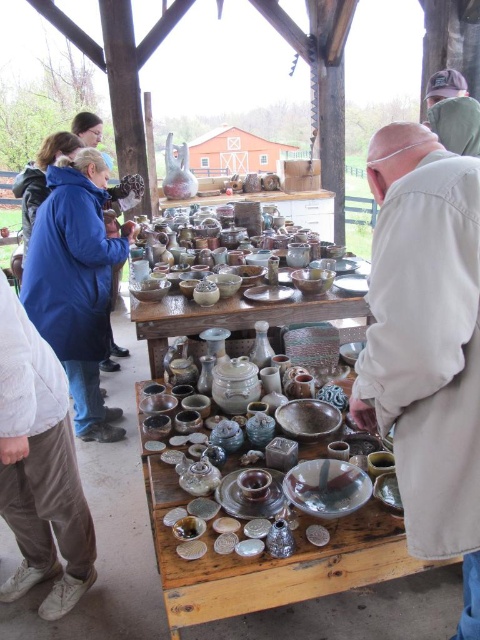
Question: In this image, where is glossy ceramic bowls at center located relative to green fabric cap at upper right?

Choices:
 (A) below
 (B) above

Answer: (A)

Question: In this image, where is glossy ceramic bowls at center located relative to green fabric cap at upper right?

Choices:
 (A) below
 (B) above

Answer: (A)

Question: Based on their relative distances, which object is farther from the glossy ceramic bowls at center?

Choices:
 (A) green fabric cap at upper right
 (B) beige fabric shirt at right

Answer: (B)

Question: Which object appears closest to the camera in this image?

Choices:
 (A) glossy ceramic bowls at center
 (B) beige fabric shirt at right
 (C) green fabric cap at upper right

Answer: (B)

Question: Which of the following is the closest to the observer?

Choices:
 (A) (252, 282)
 (B) (441, 332)

Answer: (B)

Question: Can you confirm if beige fabric shirt at right is positioned to the right of glossy ceramic bowls at center?

Choices:
 (A) yes
 (B) no

Answer: (A)